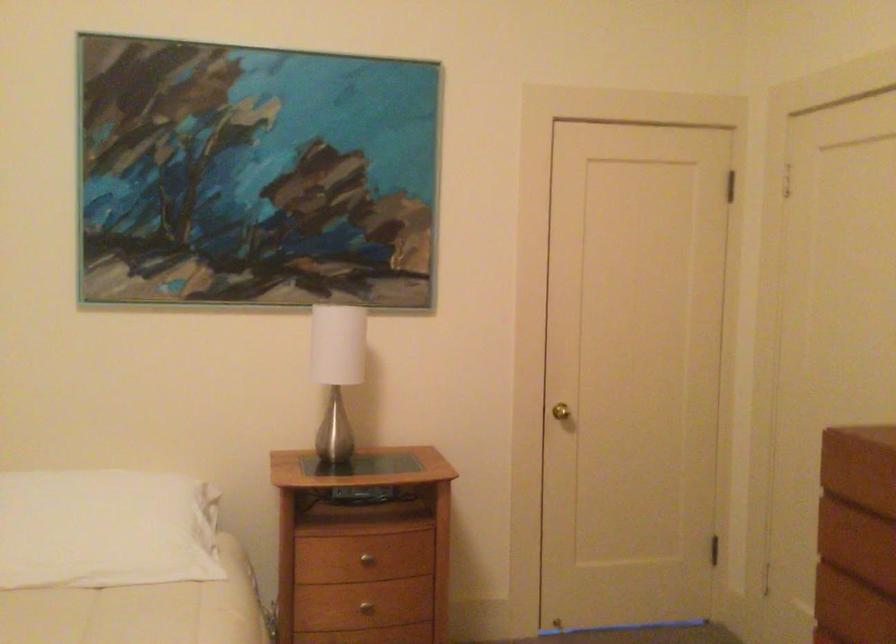
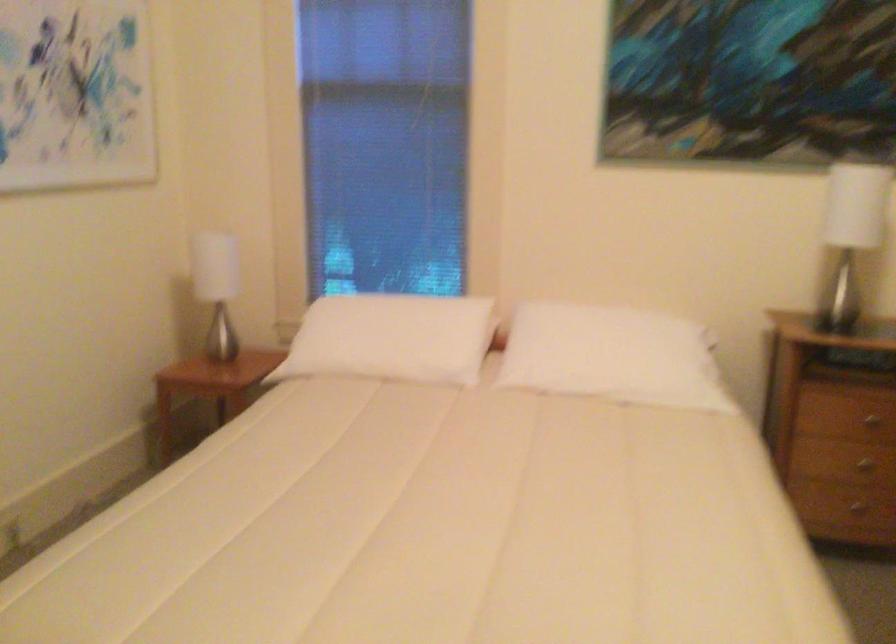
What movement of the cameraman would produce the second image?

The cameraman walked toward left, backward.